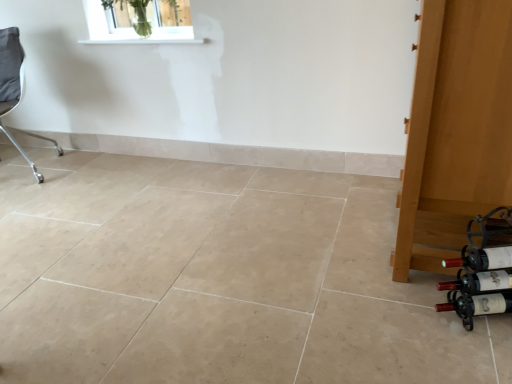
Question: Is gray fabric chair at left thinner than white smooth window sill at upper center?

Choices:
 (A) yes
 (B) no

Answer: (B)

Question: Can we say gray fabric chair at left lies outside white smooth window sill at upper center?

Choices:
 (A) yes
 (B) no

Answer: (A)

Question: Is gray fabric chair at left far from white smooth window sill at upper center?

Choices:
 (A) yes
 (B) no

Answer: (B)

Question: Is gray fabric chair at left surrounding white smooth window sill at upper center?

Choices:
 (A) yes
 (B) no

Answer: (B)

Question: Is gray fabric chair at left smaller than white smooth window sill at upper center?

Choices:
 (A) no
 (B) yes

Answer: (A)

Question: From a real-world perspective, is gray fabric chair at left located beneath white smooth window sill at upper center?

Choices:
 (A) yes
 (B) no

Answer: (A)

Question: From the image's perspective, is matte glass wine bottle at lower right, the 2th wine bottle positioned from the bottom, beneath clear glass vase at upper center?

Choices:
 (A) yes
 (B) no

Answer: (A)

Question: From a real-world perspective, is matte glass wine bottle at lower right, the 3th wine bottle in the top-to-bottom sequence, below clear glass vase at upper center?

Choices:
 (A) no
 (B) yes

Answer: (B)

Question: Can you confirm if matte glass wine bottle at lower right, the 3th wine bottle in the top-to-bottom sequence, is taller than clear glass vase at upper center?

Choices:
 (A) yes
 (B) no

Answer: (B)

Question: Considering the relative sizes of matte glass wine bottle at lower right, the 3th wine bottle in the top-to-bottom sequence, and clear glass vase at upper center in the image provided, is matte glass wine bottle at lower right, the 3th wine bottle in the top-to-bottom sequence, smaller than clear glass vase at upper center?

Choices:
 (A) no
 (B) yes

Answer: (B)

Question: Is matte glass wine bottle at lower right, the 2th wine bottle positioned from the bottom, completely or partially outside of clear glass vase at upper center?

Choices:
 (A) yes
 (B) no

Answer: (A)

Question: Does matte glass wine bottle at lower right, the 2th wine bottle positioned from the bottom, touch clear glass vase at upper center?

Choices:
 (A) yes
 (B) no

Answer: (B)

Question: Is wooden door at right not inside clear glass vase at upper center?

Choices:
 (A) yes
 (B) no

Answer: (A)